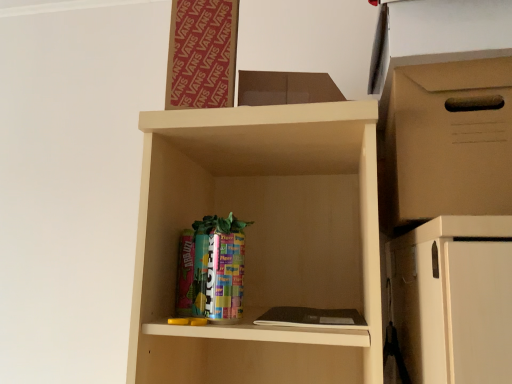
Question: Is the position of brown cardboard box at right more distant than that of red cardboard bulletin board at upper center?

Choices:
 (A) no
 (B) yes

Answer: (A)

Question: Can you confirm if brown cardboard box at right is bigger than red cardboard bulletin board at upper center?

Choices:
 (A) no
 (B) yes

Answer: (B)

Question: Does brown cardboard box at right have a smaller size compared to red cardboard bulletin board at upper center?

Choices:
 (A) yes
 (B) no

Answer: (B)

Question: Is red cardboard bulletin board at upper center at the back of brown cardboard box at right?

Choices:
 (A) no
 (B) yes

Answer: (A)

Question: From a real-world perspective, is brown cardboard box at right positioned under red cardboard bulletin board at upper center based on gravity?

Choices:
 (A) yes
 (B) no

Answer: (A)

Question: Is brown cardboard box at right thinner than red cardboard bulletin board at upper center?

Choices:
 (A) yes
 (B) no

Answer: (B)

Question: From the image's perspective, is red cardboard bulletin board at upper center beneath brown cardboard box at right?

Choices:
 (A) yes
 (B) no

Answer: (B)

Question: Does red cardboard bulletin board at upper center have a lesser height compared to brown cardboard box at right?

Choices:
 (A) yes
 (B) no

Answer: (B)

Question: Is red cardboard bulletin board at upper center surrounding brown cardboard box at right?

Choices:
 (A) yes
 (B) no

Answer: (B)

Question: Could you tell me if red cardboard bulletin board at upper center is facing brown cardboard box at right?

Choices:
 (A) yes
 (B) no

Answer: (B)

Question: Is red cardboard bulletin board at upper center positioned behind brown cardboard box at right?

Choices:
 (A) yes
 (B) no

Answer: (A)

Question: Is red cardboard bulletin board at upper center positioned with its back to brown cardboard box at right?

Choices:
 (A) no
 (B) yes

Answer: (A)

Question: Is red cardboard bulletin board at upper center bigger or smaller than brown cardboard box at right?

Choices:
 (A) big
 (B) small

Answer: (B)